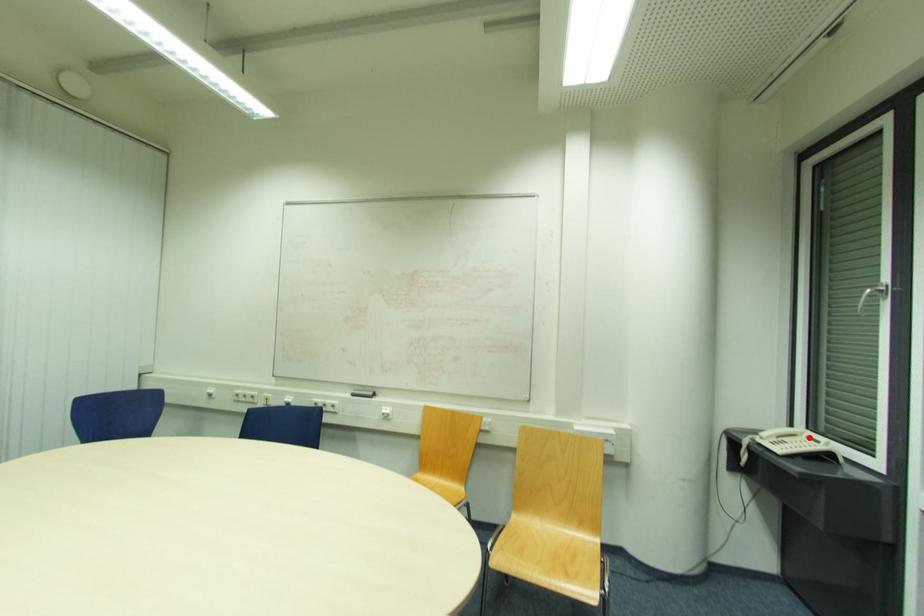
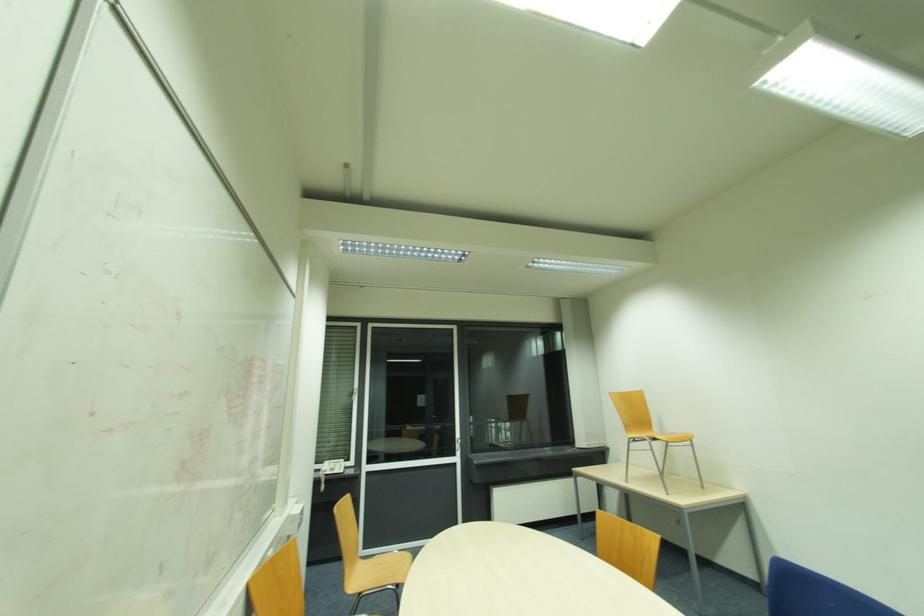
In the second image, find the point that corresponds to the highlighted location in the first image.

(334, 463)